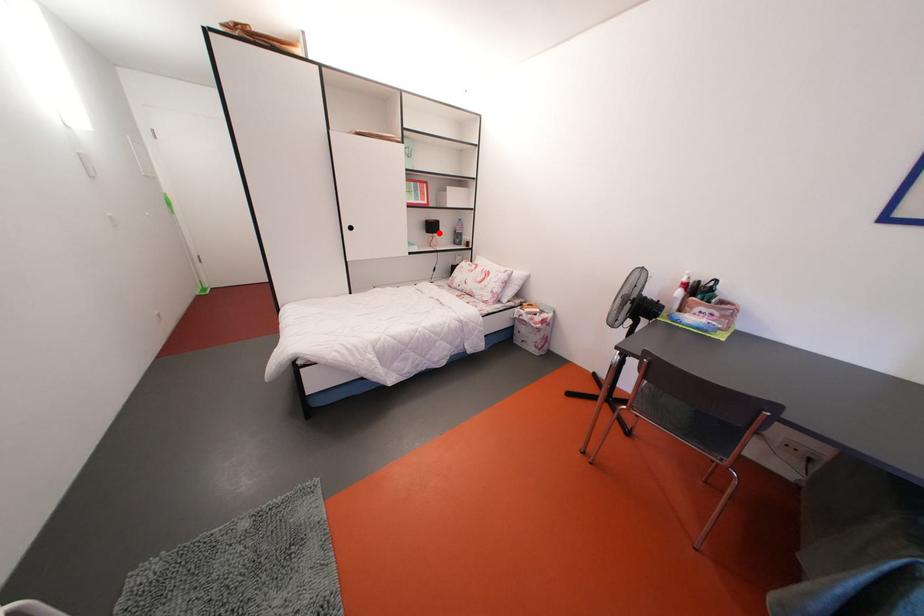
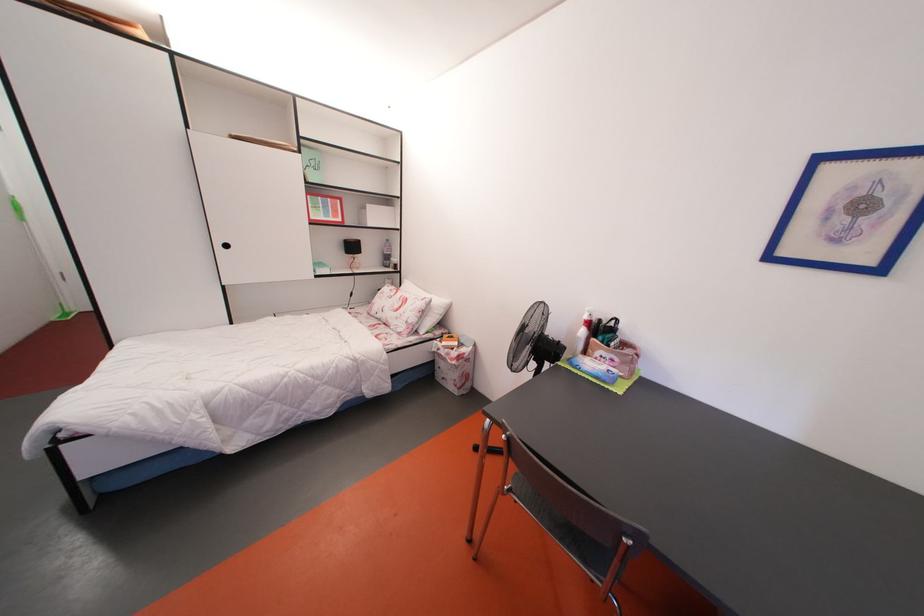
Where in the second image is the point corresponding to the highlighted location from the first image?

(359, 253)